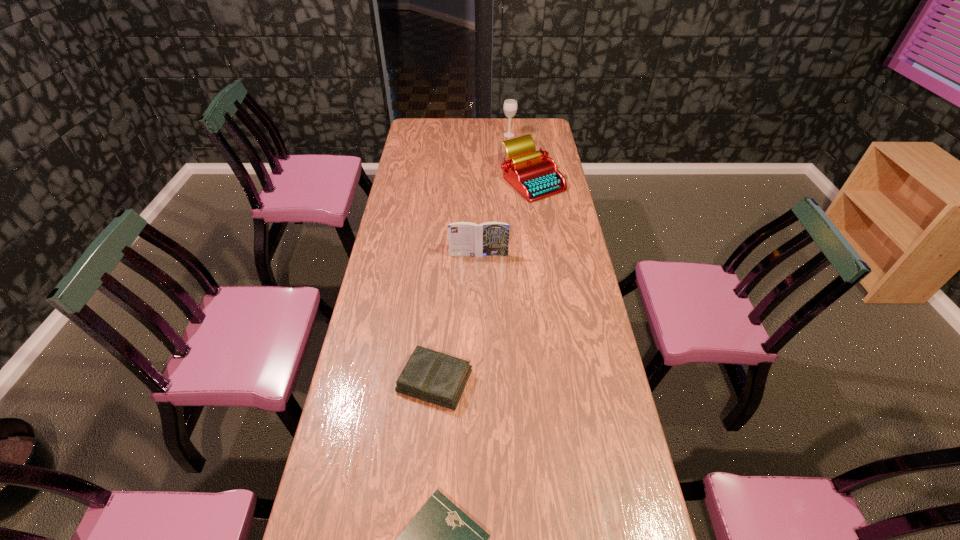
Choose which object is the nearest neighbor to the farthest object. Please provide its 2D coordinates. Your answer should be formatted as a tuple, i.e. [(x, y)], where the tuple contains the x and y coordinates of a point satisfying the conditions above.

[(533, 174)]

Select which object is the fourth closest to the nearest object. Please provide its 2D coordinates. Your answer should be formatted as a tuple, i.e. [(x, y)], where the tuple contains the x and y coordinates of a point satisfying the conditions above.

[(510, 105)]

Image resolution: width=960 pixels, height=540 pixels. In order to click on book that can be found as the closest to the second farthest object in this screenshot , I will do `click(465, 238)`.

Select which book is the second closest to the nearest object. Please provide its 2D coordinates. Your answer should be formatted as a tuple, i.e. [(x, y)], where the tuple contains the x and y coordinates of a point satisfying the conditions above.

[(465, 238)]

Find the location of a particular element. vacant space that satisfies the following two spatial constraints: 1. on the back side of the wineglass; 2. on the right side of the second nearest book is located at coordinates (455, 135).